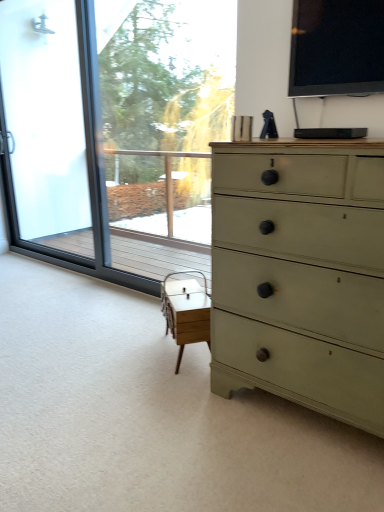
Find the location of a particular element. This screenshot has height=512, width=384. vacant area situated below white wood table at center (from a real-world perspective) is located at coordinates (193, 352).